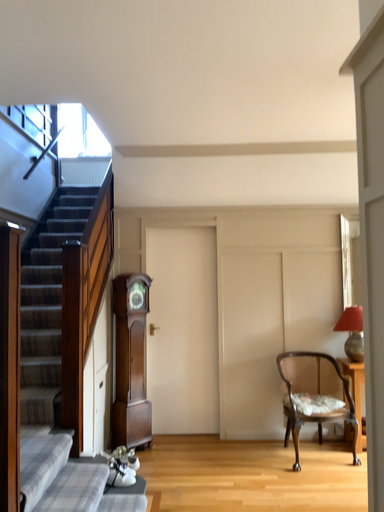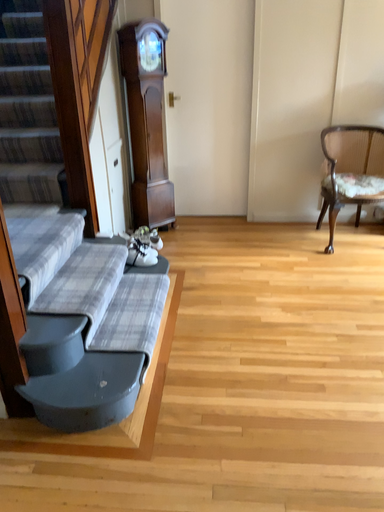
Question: How did the camera likely rotate when shooting the video?

Choices:
 (A) rotated upward
 (B) rotated downward

Answer: (B)